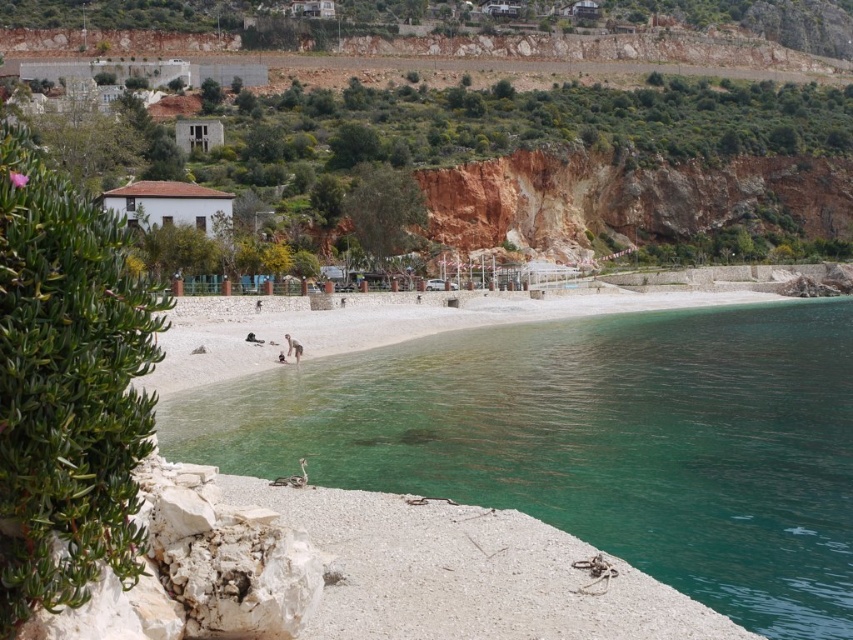
In the scene shown: Does white gravel at lower left have a lesser width compared to white fabric person at center?

No.

Is white gravel at lower left positioned in front of white fabric person at center?

Yes.

This screenshot has width=853, height=640. I want to click on white gravel at lower left, so click(x=467, y=573).

Is white gravel at lower left to the left of white sand beach at center from the viewer's perspective?

Correct, you'll find white gravel at lower left to the left of white sand beach at center.

Consider the image. Between white gravel at lower left and white sand beach at center, which one is positioned lower?

Positioned lower is white gravel at lower left.

Which is behind, point (524, 620) or point (566, 296)?

Positioned behind is point (566, 296).

Where is `white gravel at lower left`? The width and height of the screenshot is (853, 640). white gravel at lower left is located at coordinates (467, 573).

Does point (404, 355) come closer to viewer compared to point (221, 337)?

No, it is not.

Is green smooth water at center bigger than white sand beach at center?

Correct, green smooth water at center is larger in size than white sand beach at center.

What do you see at coordinates (593, 442) in the screenshot? I see `green smooth water at center` at bounding box center [593, 442].

Locate an element on the screen. This screenshot has width=853, height=640. green smooth water at center is located at coordinates (593, 442).